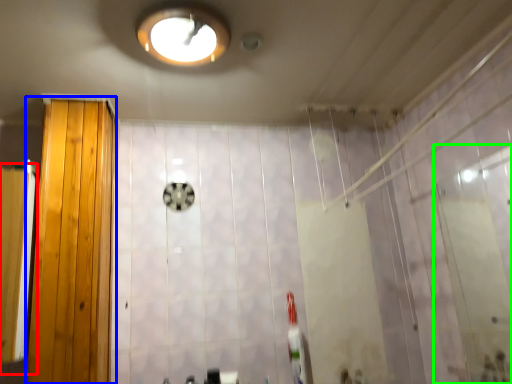
Question: Which object is positioned closest to screen door (highlighted by a red box)? Select from door (highlighted by a blue box) and screen door (highlighted by a green box).

Choices:
 (A) door
 (B) screen door

Answer: (A)